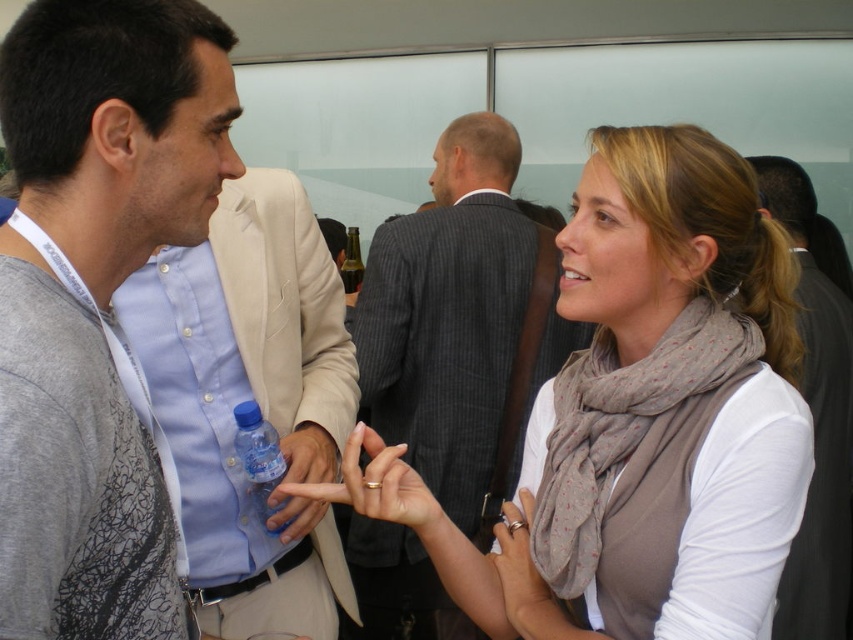
You are at a networking event and see the dark gray suit at center and the blue plastic bottle at center. Which object is closer to you?

The dark gray suit at center is closer to you because the blue plastic bottle at center is behind it.